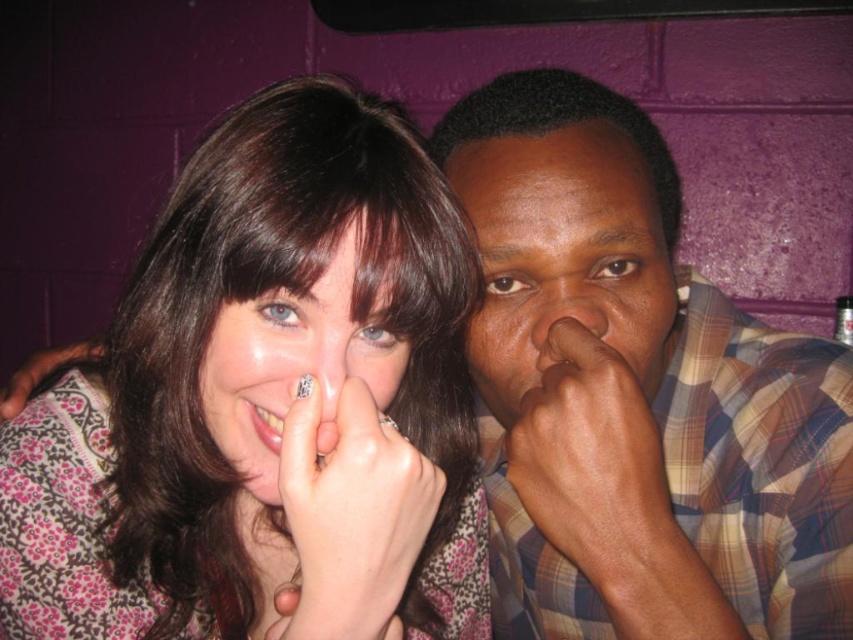
Question: Which object is farther from the camera taking this photo?

Choices:
 (A) matte floral-patterned hand at lower left
 (B) matte plaid shirt at center
 (C) matte skin nose at center

Answer: (A)

Question: Which point is closer to the camera taking this photo?

Choices:
 (A) (381, 417)
 (B) (4, 410)
 (C) (651, 236)
 (D) (305, 522)

Answer: (D)

Question: From the image, what is the correct spatial relationship of pink floral sweater at center in relation to white painted nails at center?

Choices:
 (A) below
 (B) above

Answer: (A)

Question: Among these points, which one is nearest to the camera?

Choices:
 (A) (508, 184)
 (B) (538, 317)
 (C) (299, 417)
 (D) (325, 428)

Answer: (C)

Question: Is dark brown skin/hair at nose to the left of white painted nails at center from the viewer's perspective?

Choices:
 (A) no
 (B) yes

Answer: (A)

Question: Can you confirm if matte floral shirt at center is positioned to the left of smooth skin nose at center?

Choices:
 (A) yes
 (B) no

Answer: (A)